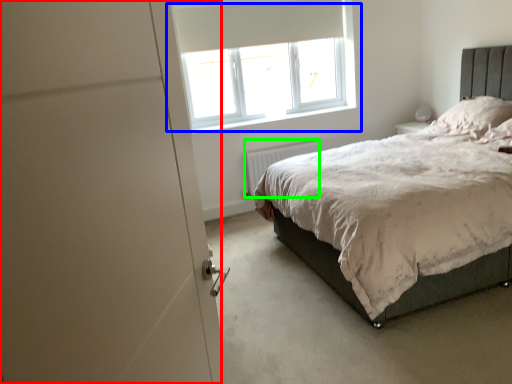
Question: Which object is the farthest from screen door (highlighted by a red box)? Choose among these: window (highlighted by a blue box) or radiator (highlighted by a green box).

Choices:
 (A) window
 (B) radiator

Answer: (A)